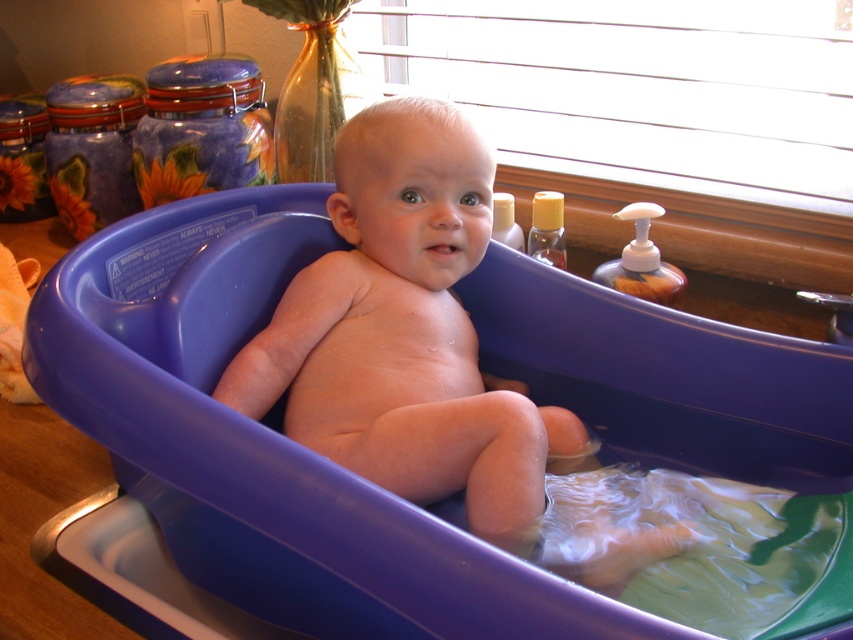
Question: Does purple plastic tub at center appear on the left side of smooth plastic baby at center?

Choices:
 (A) no
 (B) yes

Answer: (A)

Question: Among these objects, which one is nearest to the camera?

Choices:
 (A) translucent plastic soap dispenser at right
 (B) smooth plastic baby at center

Answer: (B)

Question: Can you confirm if purple plastic tub at center is positioned to the left of translucent plastic soap dispenser at right?

Choices:
 (A) no
 (B) yes

Answer: (B)

Question: Estimate the real-world distances between objects in this image. Which object is farther from the translucent plastic soap dispenser at right?

Choices:
 (A) smooth plastic baby at center
 (B) purple plastic tub at center

Answer: (B)

Question: Does smooth plastic baby at center appear on the left side of translucent plastic soap dispenser at right?

Choices:
 (A) yes
 (B) no

Answer: (A)

Question: Based on their relative distances, which object is farther from the smooth plastic baby at center?

Choices:
 (A) purple plastic tub at center
 (B) translucent plastic soap dispenser at right

Answer: (B)